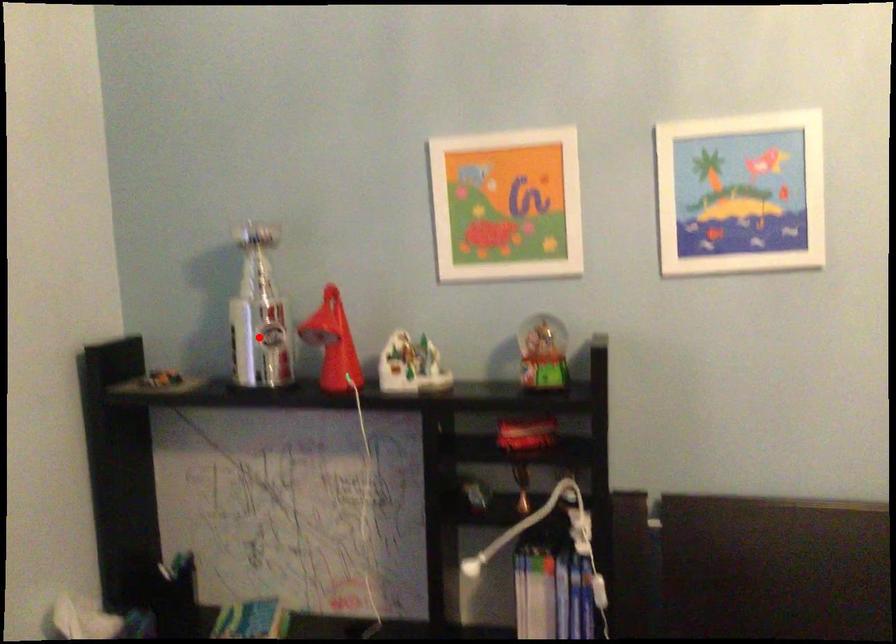
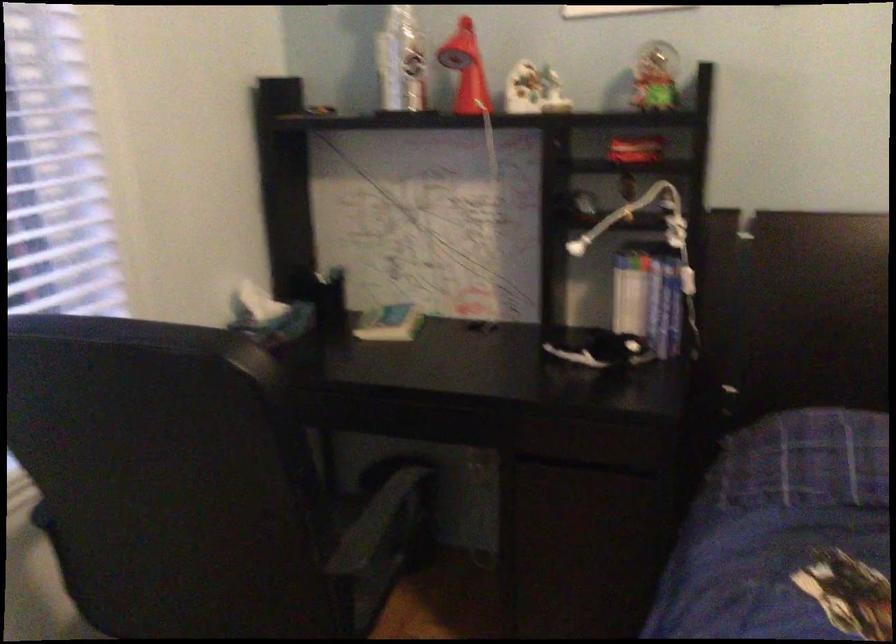
The point at the highlighted location is marked in the first image. Where is the corresponding point in the second image?

(401, 62)